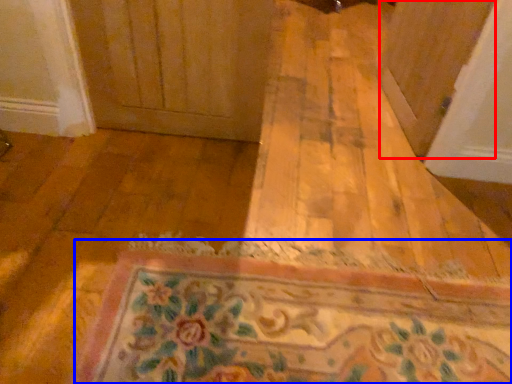
Question: Which object appears farthest to the camera in this image, screen door (highlighted by a red box) or bath mat (highlighted by a blue box)?

Choices:
 (A) screen door
 (B) bath mat

Answer: (A)